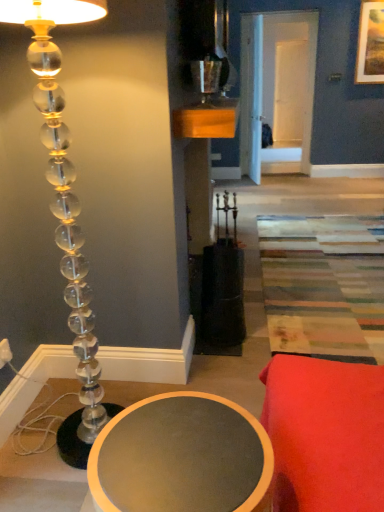
Question: Is matte gray table at lower left with metallic silver candle holder at upper center?

Choices:
 (A) yes
 (B) no

Answer: (B)

Question: From a real-world perspective, does matte gray table at lower left stand above metallic silver candle holder at upper center?

Choices:
 (A) no
 (B) yes

Answer: (A)

Question: Can you confirm if matte gray table at lower left is positioned to the left of metallic silver candle holder at upper center?

Choices:
 (A) yes
 (B) no

Answer: (A)

Question: Considering the relative sizes of matte gray table at lower left and metallic silver candle holder at upper center in the image provided, is matte gray table at lower left wider than metallic silver candle holder at upper center?

Choices:
 (A) no
 (B) yes

Answer: (B)

Question: Considering the relative sizes of matte gray table at lower left and metallic silver candle holder at upper center in the image provided, is matte gray table at lower left thinner than metallic silver candle holder at upper center?

Choices:
 (A) yes
 (B) no

Answer: (B)

Question: From the image's perspective, is clear acrylic lamp at left positioned above or below wooden framed landscape painting at upper right?

Choices:
 (A) above
 (B) below

Answer: (B)

Question: From a real-world perspective, is clear acrylic lamp at left physically located above or below wooden framed landscape painting at upper right?

Choices:
 (A) below
 (B) above

Answer: (A)

Question: In terms of height, does clear acrylic lamp at left look taller or shorter compared to wooden framed landscape painting at upper right?

Choices:
 (A) tall
 (B) short

Answer: (A)

Question: Based on their sizes in the image, would you say clear acrylic lamp at left is bigger or smaller than wooden framed landscape painting at upper right?

Choices:
 (A) small
 (B) big

Answer: (B)

Question: From a real-world perspective, is wooden framed landscape painting at upper right above or below clear acrylic lamp at left?

Choices:
 (A) above
 (B) below

Answer: (A)

Question: From their relative heights in the image, would you say wooden framed landscape painting at upper right is taller or shorter than clear acrylic lamp at left?

Choices:
 (A) short
 (B) tall

Answer: (A)

Question: Is point (364, 4) positioned closer to the camera than point (31, 14)?

Choices:
 (A) closer
 (B) farther

Answer: (B)

Question: Considering the relative positions of wooden framed landscape painting at upper right and clear acrylic lamp at left in the image provided, is wooden framed landscape painting at upper right to the left or to the right of clear acrylic lamp at left?

Choices:
 (A) left
 (B) right

Answer: (B)

Question: From the image's perspective, is metallic silver candle holder at upper center positioned above or below clear acrylic lamp at left?

Choices:
 (A) above
 (B) below

Answer: (A)

Question: Is metallic silver candle holder at upper center inside the boundaries of clear acrylic lamp at left, or outside?

Choices:
 (A) outside
 (B) inside

Answer: (A)